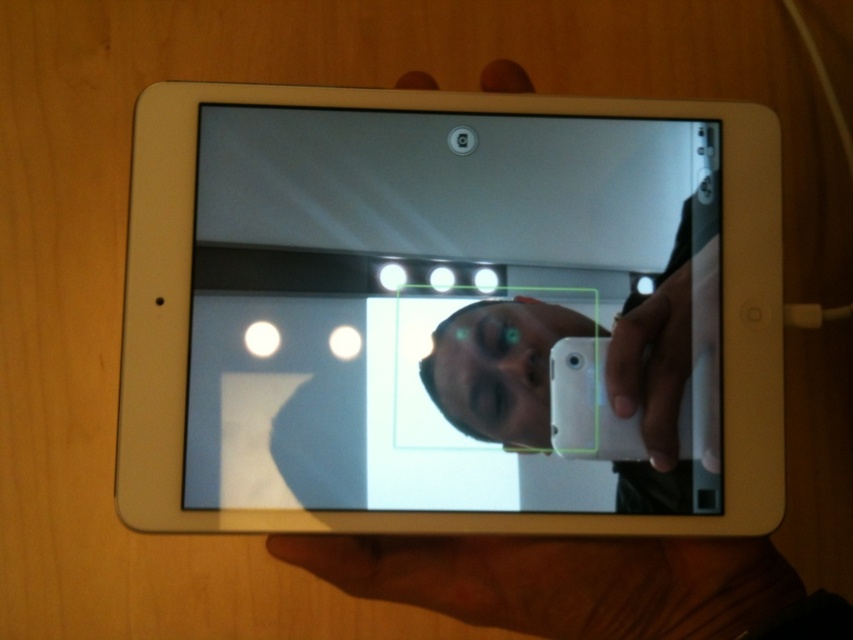
You are trying to take a photo with your tablet. You notice the white plastic tablet at center and the brown leather hand at lower center. Which object is positioned higher in the image?

The white plastic tablet at center is located above the brown leather hand at lower center, so it is positioned higher.

You are looking at the tablet screen and see two points marked on it. The first point is at position point (622, 260) and the second is at point (344, 568). Which point is closer to you?

Point (622, 260) is further to the viewer than point (344, 568). Therefore, point (344, 568) is closer to you.